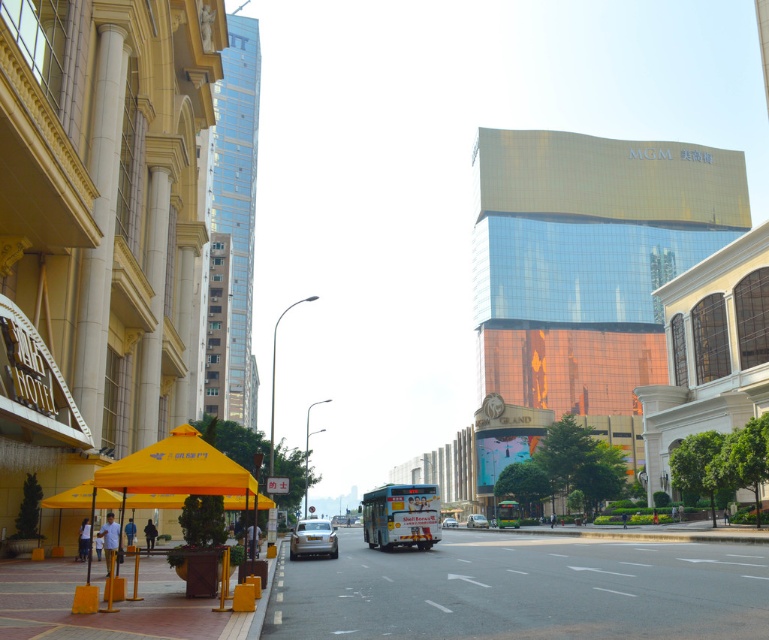
You are standing on the sidewalk and want to cross the street to reach the building with the HOTEL sign. According to the image, where is the gray asphalt road at center in relation to your position?

The gray asphalt road at center is located at point [521,589], which means it is directly in front of you, so you should cross there to reach the building with the HOTEL sign.

You are a pedestrian standing on the sidewalk and want to cross the gray asphalt road at center. You see the white glossy bus at center in your path. Based on the scene description, can you safely walk around the bus to cross the road?

The gray asphalt road at center is much taller than the white glossy bus at center, so the bus is likely positioned lower or closer to the ground. This means the bus might not block your path entirely, allowing you to safely walk around it to cross the road.